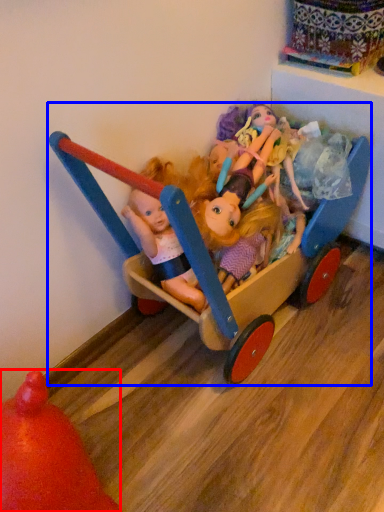
Question: Which object is closer to the camera taking this photo, toy (highlighted by a red box) or toy (highlighted by a blue box)?

Choices:
 (A) toy
 (B) toy

Answer: (A)